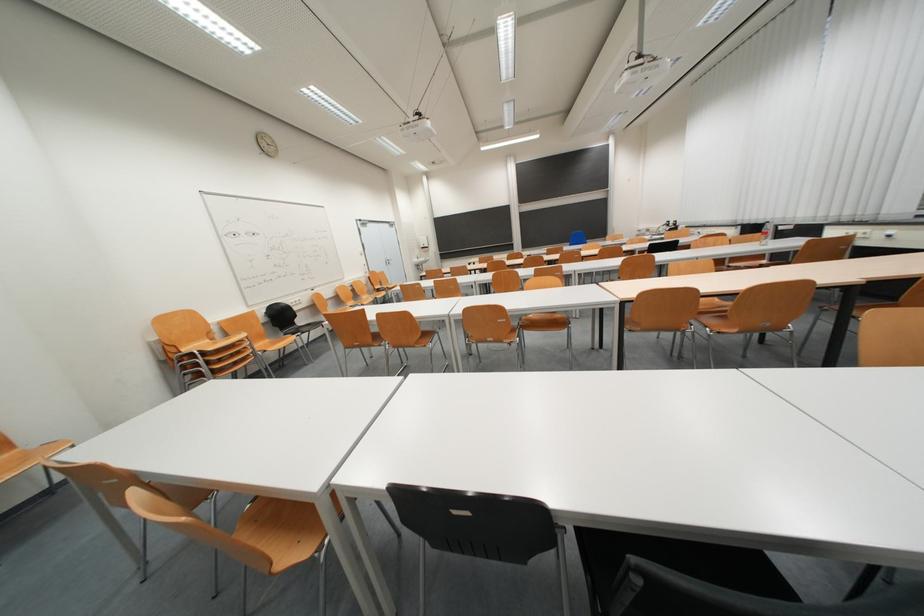
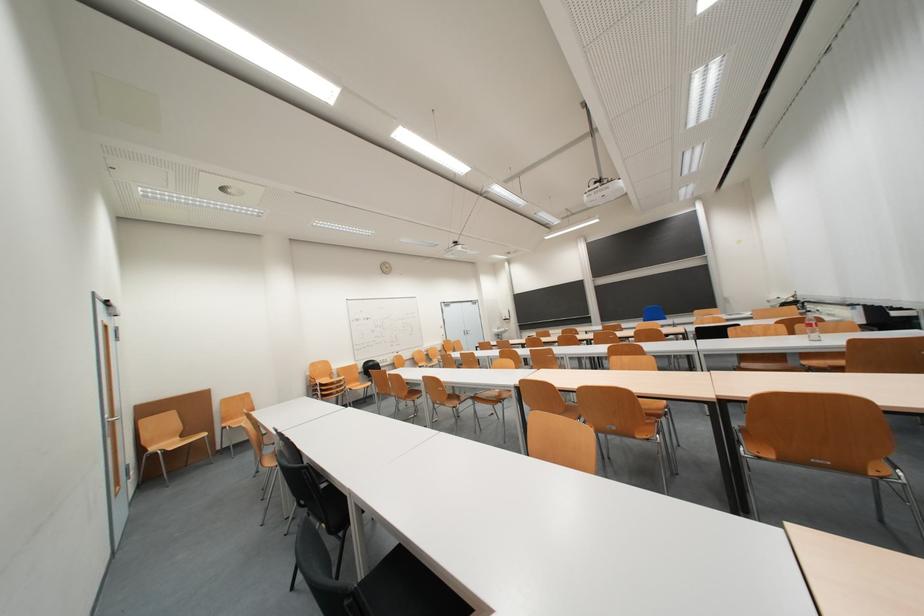
Where in the second image is the point corresponding to [223,323] from the first image?

(343, 371)